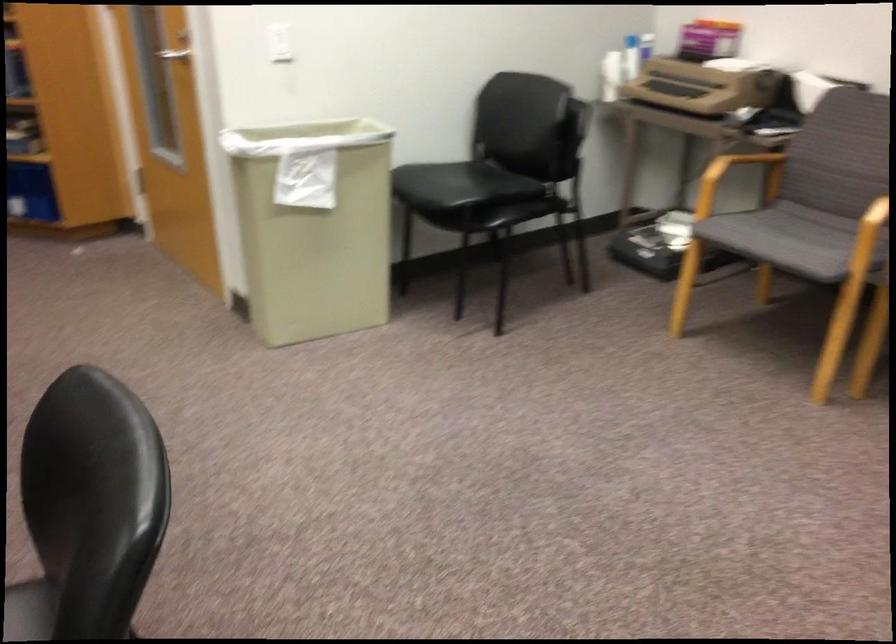
In order to click on white light switch in this screenshot , I will do `click(279, 33)`.